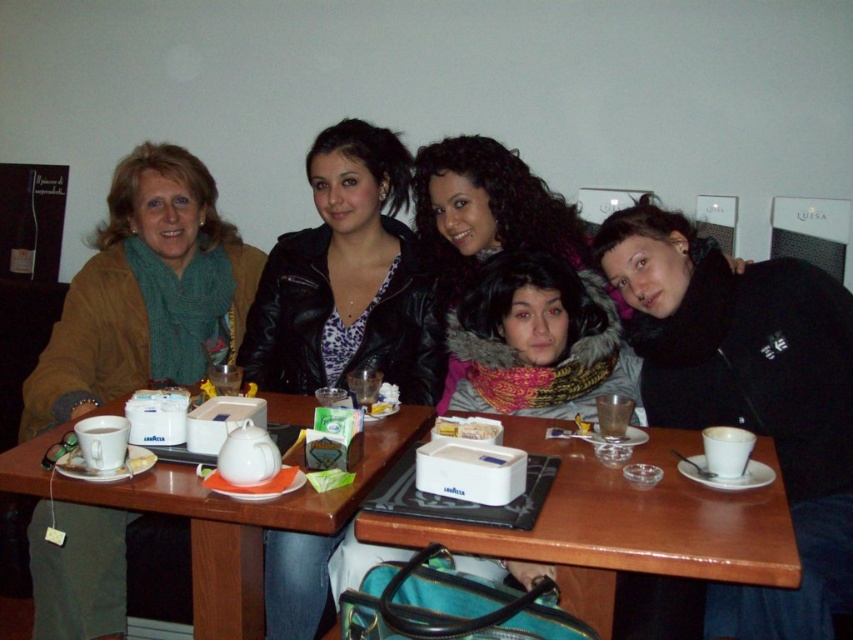
You are taking a photo of the group at the table. You notice two points on the table surface labeled as point (384, 182) and point (436, 420). Which point is closer to the camera?

Point (384, 182) is further to the camera than point (436, 420), so point (436, 420) is closer to the camera.

You are a photographer taking a group photo of the five individuals around the wooden table. You want to ensure both the green knitted scarf at left and the leather jacket at center are visible in the frame. Based on their positions, which object should you prioritize keeping in the left side of the photo?

The green knitted scarf at left should be prioritized on the left side of the photo since it is positioned to the left of the leather jacket at center.

You are standing at the entrance of the restaurant and see the point marked at coordinates (347, 280). Which object is located at that point?

The point marked at coordinates (347, 280) is located on the leather jacket at center.